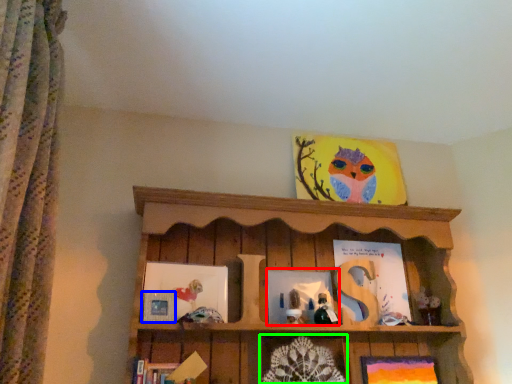
Question: Which object is positioned closest to picture frame (highlighted by a red box)? Select from picture frame (highlighted by a blue box) and picture frame (highlighted by a green box).

Choices:
 (A) picture frame
 (B) picture frame

Answer: (B)